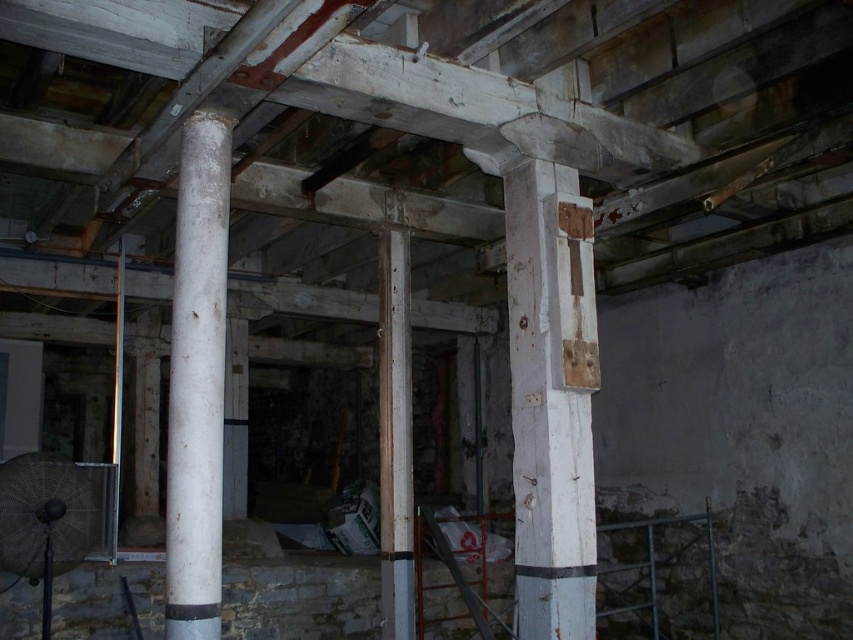
Is point (200, 163) positioned in front of point (404, 467)?

Yes, it is.

In the scene shown: Does white matte column at center have a greater height compared to rusty metal pole at center?

No, white matte column at center is not taller than rusty metal pole at center.

Identify the location of white matte column at center. click(x=196, y=380).

Is point (514, 560) positioned before point (204, 243)?

No, it is not.

Is point (514, 468) more distant than point (175, 426)?

Yes, it is.

Does point (560, 317) come closer to viewer compared to point (196, 600)?

No, it is behind (196, 600).

Find the location of a particular element. white wood pillar at center is located at coordinates click(550, 397).

Between white wood pillar at center and rusty metal pole at center, which one has more height?

rusty metal pole at center is taller.

Which is above, white wood pillar at center or rusty metal pole at center?

white wood pillar at center

The image size is (853, 640). Identify the location of white wood pillar at center. (550, 397).